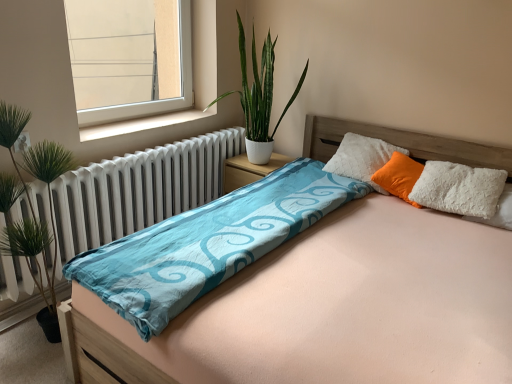
Question: From a real-world perspective, is green glossy plant at upper center, which appears as the second vegetation when viewed from the left, on top of white matte nightstand at center?

Choices:
 (A) no
 (B) yes

Answer: (B)

Question: Can you confirm if green glossy plant at upper center, which appears as the second vegetation when viewed from the left, is taller than white matte nightstand at center?

Choices:
 (A) yes
 (B) no

Answer: (A)

Question: Considering the relative sizes of green glossy plant at upper center, the second vegetation in the front-to-back sequence, and white matte nightstand at center in the image provided, is green glossy plant at upper center, the second vegetation in the front-to-back sequence, shorter than white matte nightstand at center?

Choices:
 (A) no
 (B) yes

Answer: (A)

Question: Considering the relative sizes of green glossy plant at upper center, the second vegetation in the front-to-back sequence, and white matte nightstand at center in the image provided, is green glossy plant at upper center, the second vegetation in the front-to-back sequence, bigger than white matte nightstand at center?

Choices:
 (A) yes
 (B) no

Answer: (A)

Question: Could you tell me if green glossy plant at upper center, the 1th vegetation viewed from the right, is facing white matte nightstand at center?

Choices:
 (A) yes
 (B) no

Answer: (B)

Question: Is green glossy plant at upper center, positioned as the first vegetation in back-to-front order, smaller than white matte nightstand at center?

Choices:
 (A) yes
 (B) no

Answer: (B)

Question: Are transparent glass window at upper left and orange soft pillow at upper right located far from each other?

Choices:
 (A) no
 (B) yes

Answer: (B)

Question: Does transparent glass window at upper left have a greater height compared to orange soft pillow at upper right?

Choices:
 (A) yes
 (B) no

Answer: (A)

Question: Is transparent glass window at upper left smaller than orange soft pillow at upper right?

Choices:
 (A) yes
 (B) no

Answer: (B)

Question: Can you confirm if transparent glass window at upper left is shorter than orange soft pillow at upper right?

Choices:
 (A) yes
 (B) no

Answer: (B)

Question: Does transparent glass window at upper left come in front of orange soft pillow at upper right?

Choices:
 (A) no
 (B) yes

Answer: (B)

Question: Is transparent glass window at upper left next to orange soft pillow at upper right and touching it?

Choices:
 (A) no
 (B) yes

Answer: (A)

Question: Is orange soft pillow at upper right taller than white matte nightstand at center?

Choices:
 (A) yes
 (B) no

Answer: (A)